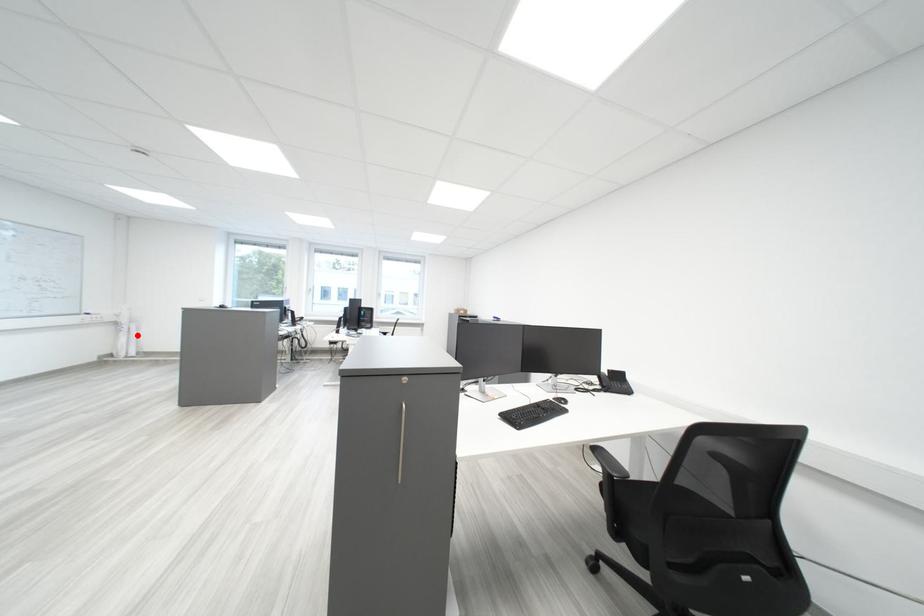
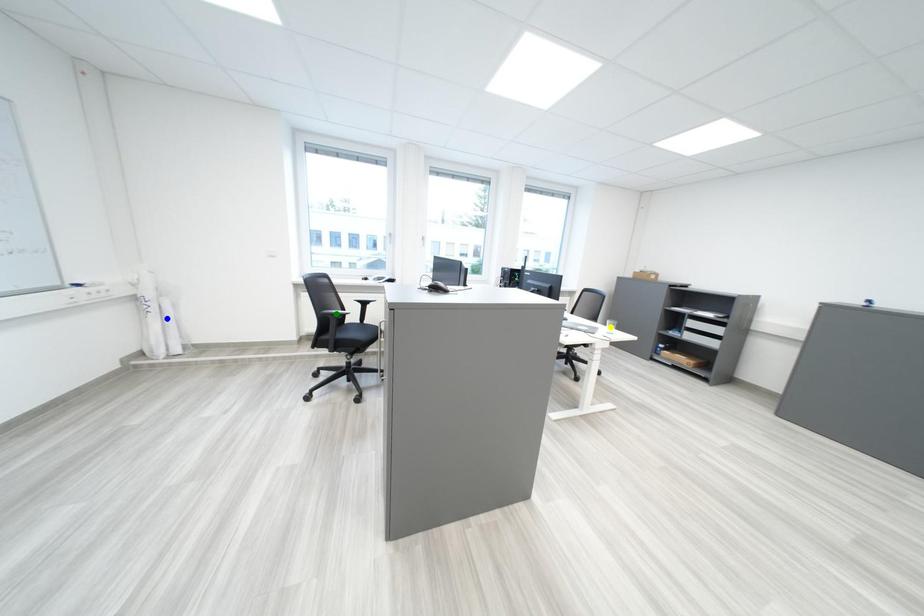
Question: I am providing you with two images of the same scene from different viewpoints. A red point is marked on the first image. You are given multiple points on the second image. Can you choose the point in image 2 that corresponds to the point in image 1?

Choices:
 (A) yellow point
 (B) green point
 (C) blue point

Answer: (C)